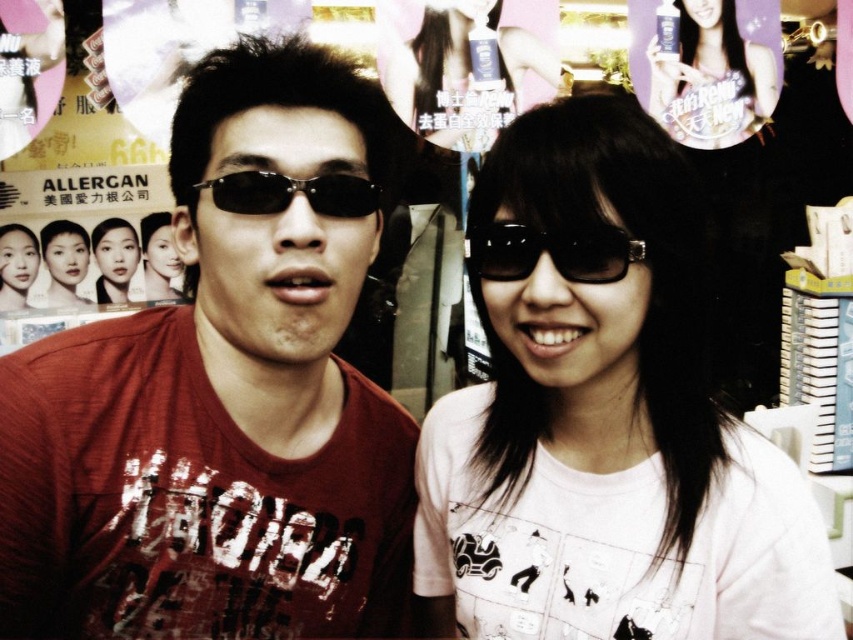
Is white matte shirt at center wider than smooth skin portrait at left?

Indeed, white matte shirt at center has a greater width compared to smooth skin portrait at left.

Between white matte shirt at center and smooth skin portrait at left, which one has less height?

With less height is smooth skin portrait at left.

This screenshot has width=853, height=640. What are the coordinates of `white matte shirt at center` in the screenshot? It's located at (602, 417).

Is smooth skin woman at center in front of smooth skin portrait at left?

No, it is not.

Is smooth skin woman at center further to camera compared to smooth skin portrait at left?

Yes, smooth skin woman at center is behind smooth skin portrait at left.

Who is more distant from viewer, (167,237) or (21,298)?

Positioned behind is point (167,237).

At what (x,y) coordinates should I click in order to perform the action: click on smooth skin woman at center. Please return your answer as a coordinate pair (x, y). The height and width of the screenshot is (640, 853). Looking at the image, I should click on (160, 257).

Who is more forward, (585, 250) or (50, 305)?

Point (585, 250)

Is black shiny sunglasses at center above matte skin at center?

No, black shiny sunglasses at center is not above matte skin at center.

The height and width of the screenshot is (640, 853). What are the coordinates of `black shiny sunglasses at center` in the screenshot? It's located at tap(552, 252).